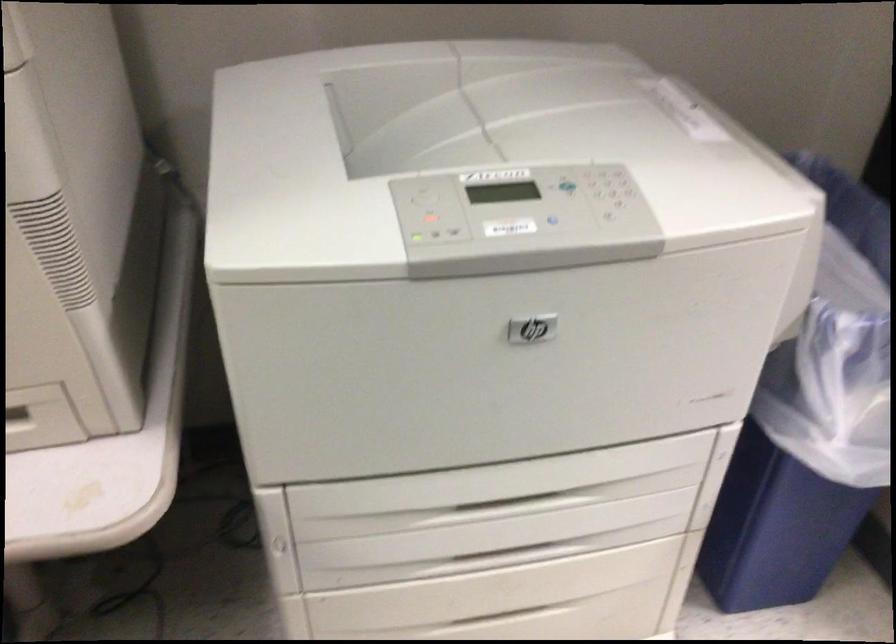
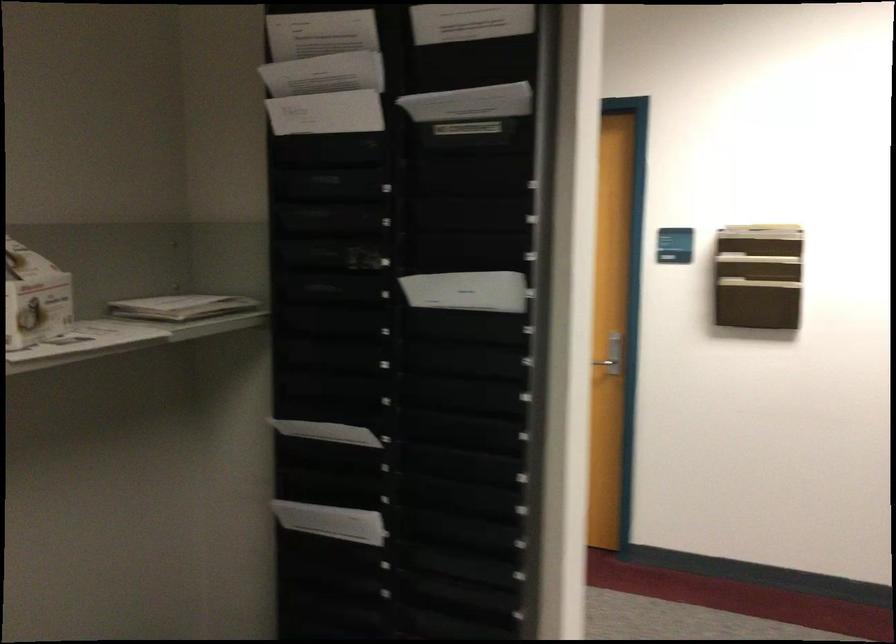
Question: The camera is either moving clockwise (left) or counter-clockwise (right) around the object. The first image is from the beginning of the video and the second image is from the end. Is the camera moving left or right when shooting the video?

Choices:
 (A) Left
 (B) Right

Answer: (A)